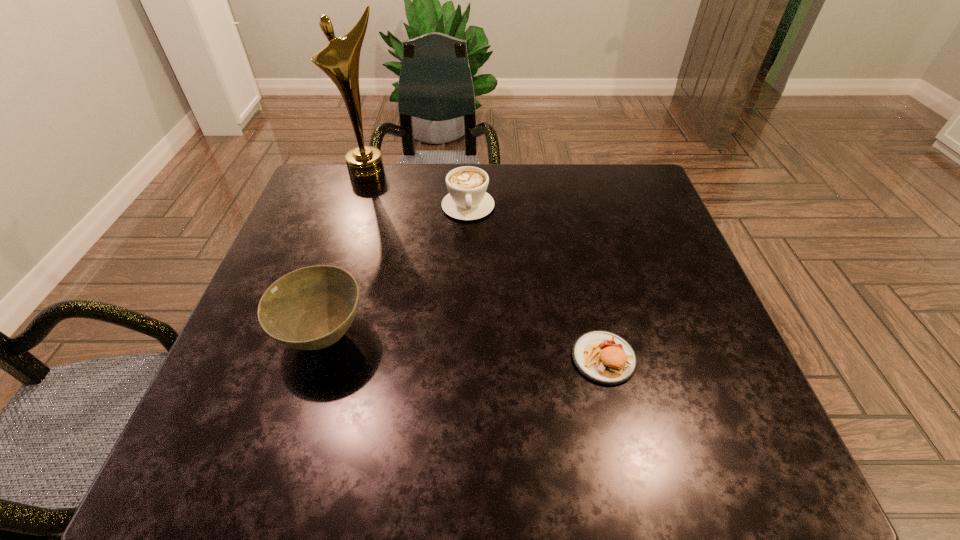
Where is `bowl`? The width and height of the screenshot is (960, 540). bowl is located at coordinates coord(311,308).

Locate an element on the screen. Image resolution: width=960 pixels, height=540 pixels. the rightmost object is located at coordinates (604, 357).

Identify the location of patty. (604, 357).

This screenshot has height=540, width=960. I want to click on the third object from left to right, so click(x=467, y=200).

The width and height of the screenshot is (960, 540). I want to click on the third tallest object, so click(467, 200).

Image resolution: width=960 pixels, height=540 pixels. Identify the location of the farthest object. (339, 59).

Where is `award`? The image size is (960, 540). award is located at coordinates (339, 59).

Image resolution: width=960 pixels, height=540 pixels. What are the coordinates of `free space located on the right of the second tallest object` in the screenshot? It's located at (459, 336).

Find the location of `free space located 0.210m on the left of the rightmost object`. free space located 0.210m on the left of the rightmost object is located at coordinates click(x=463, y=358).

At what (x,y) coordinates should I click in order to perform the action: click on vacant region located to the right of the second object from right to left's handle. Please return your answer as a coordinate pair (x, y). Looking at the image, I should click on (485, 311).